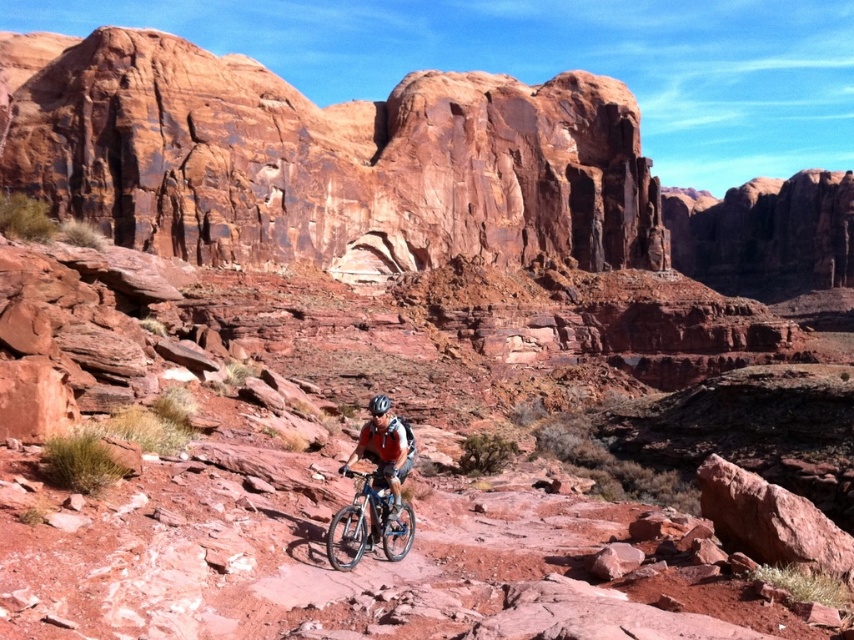
Does rustic sandstone rock formation at center appear over shiny metallic bicycle at center?

Indeed, rustic sandstone rock formation at center is positioned over shiny metallic bicycle at center.

Is rustic sandstone rock formation at center below shiny metallic bicycle at center?

Actually, rustic sandstone rock formation at center is above shiny metallic bicycle at center.

Does point (559, 124) come farther from viewer compared to point (384, 504)?

That is True.

I want to click on rustic sandstone rock formation at center, so click(x=323, y=157).

Who is shorter, shiny metallic bicycle at center or matte orange shirt at center?

shiny metallic bicycle at center

Is shiny metallic bicycle at center below matte orange shirt at center?

Yes, shiny metallic bicycle at center is below matte orange shirt at center.

What are the coordinates of `shiny metallic bicycle at center` in the screenshot? It's located at (367, 525).

Who is lower down, matte orange shirt at center or shiny silver helmet at center?

matte orange shirt at center

Can you confirm if matte orange shirt at center is bigger than shiny silver helmet at center?

Actually, matte orange shirt at center might be smaller than shiny silver helmet at center.

Where is `matte orange shirt at center`? Image resolution: width=854 pixels, height=640 pixels. matte orange shirt at center is located at coordinates (385, 456).